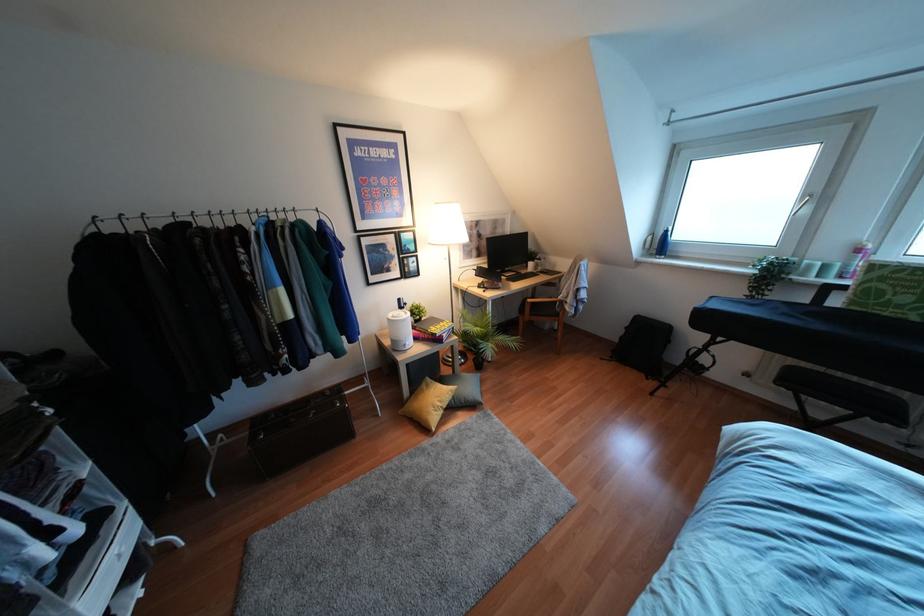
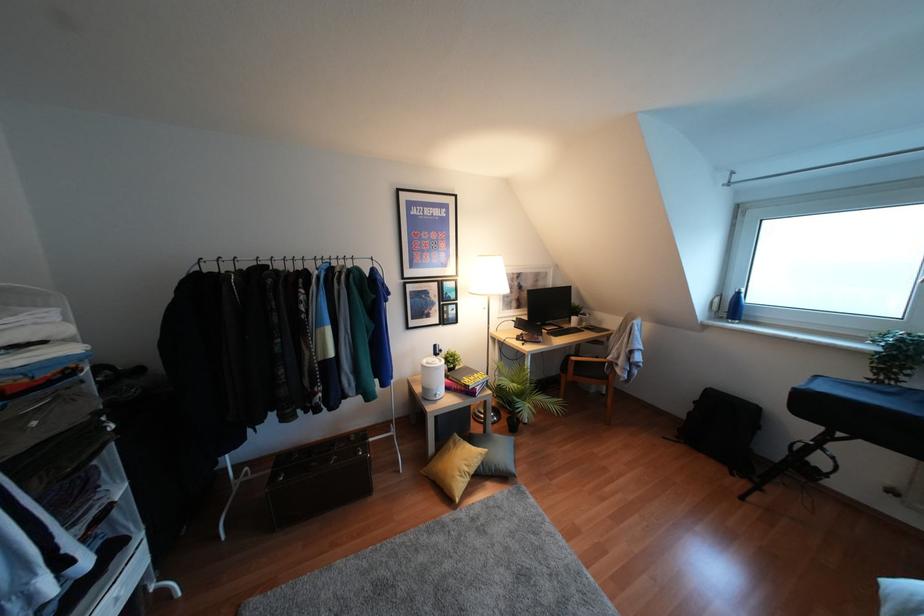
Question: The first image is from the beginning of the video and the second image is from the end. How did the camera likely rotate when shooting the video?

Choices:
 (A) Left
 (B) Right
 (C) Up
 (D) Down

Answer: (C)